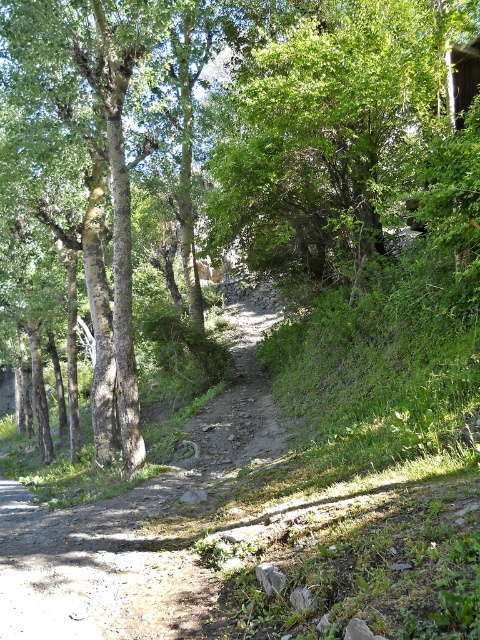
Based on the photo, you are a hiker standing on the dirt path and want to take a photo of the brown rough tree at center and the green leafy tree at upper center. Which tree should you move towards to get both trees in the frame?

You should move towards the brown rough tree at center because it is positioned on the left side of the green leafy tree at upper center, so moving towards it will keep both trees within the camera frame.

You are a hiker trying to navigate the path. Which tree should you avoid if you want to stay on the path? The green leafy tree at upper center or the rough bark tree at left?

You should avoid the green leafy tree at upper center because it has a larger size compared to the rough bark tree at left, which may block the path more.